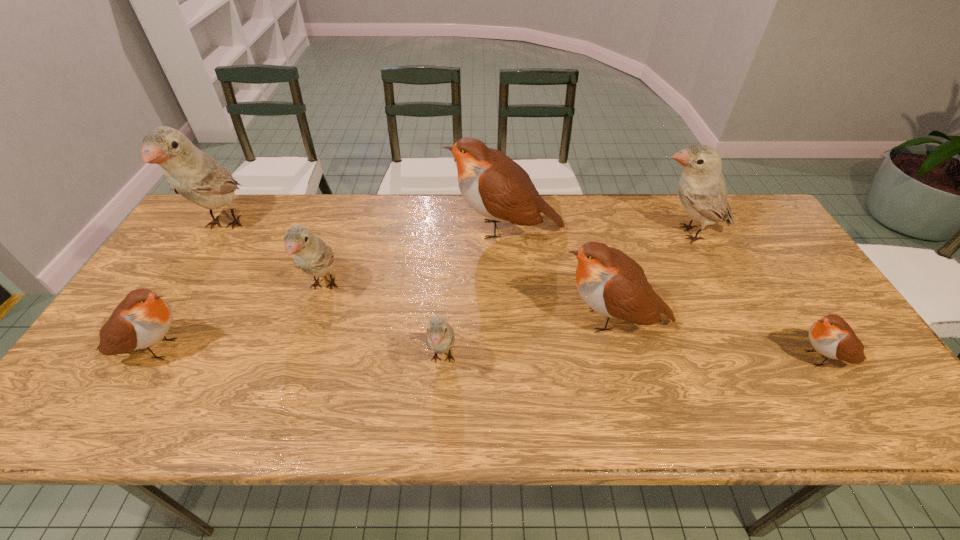
What are the coordinates of `free space between the rightmost white bird and the third biggest brown bird` in the screenshot? It's located at (420, 291).

Identify the location of vacant space in between the third bird from left to right and the tallest bird. (275, 256).

The height and width of the screenshot is (540, 960). What are the coordinates of `unoccupied position between the second biggest brown bird and the second biggest white bird` in the screenshot? It's located at (651, 276).

This screenshot has width=960, height=540. Identify the location of free space between the biggest white bird and the smallest white bird. (333, 293).

This screenshot has width=960, height=540. Identify the location of vacant space that's between the third white bird from left to right and the tallest object. (333, 293).

Find the location of `unoccupied position between the tallest object and the smallest white bird`. unoccupied position between the tallest object and the smallest white bird is located at coordinates (333, 293).

Locate an element on the screen. free spot between the biggest white bird and the smallest brown bird is located at coordinates (524, 292).

What are the coordinates of `object identified as the sixth closest to the second smallest white bird` in the screenshot? It's located at (702, 189).

Locate which object ranks sixth in proximity to the biggest white bird. Please provide its 2D coordinates. Your answer should be formatted as a tuple, i.e. [(x, y)], where the tuple contains the x and y coordinates of a point satisfying the conditions above.

[(702, 189)]

Locate which bird ranks third in proximity to the leftmost brown bird. Please provide its 2D coordinates. Your answer should be formatted as a tuple, i.e. [(x, y)], where the tuple contains the x and y coordinates of a point satisfying the conditions above.

[(440, 337)]